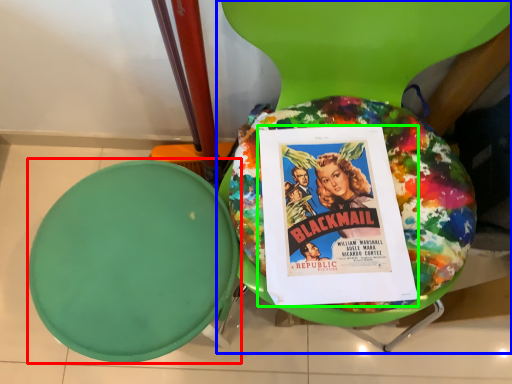
Question: Considering the real-world distances, which object is closest to round table (highlighted by a red box)? chair (highlighted by a blue box) or comic book (highlighted by a green box).

Choices:
 (A) chair
 (B) comic book

Answer: (B)